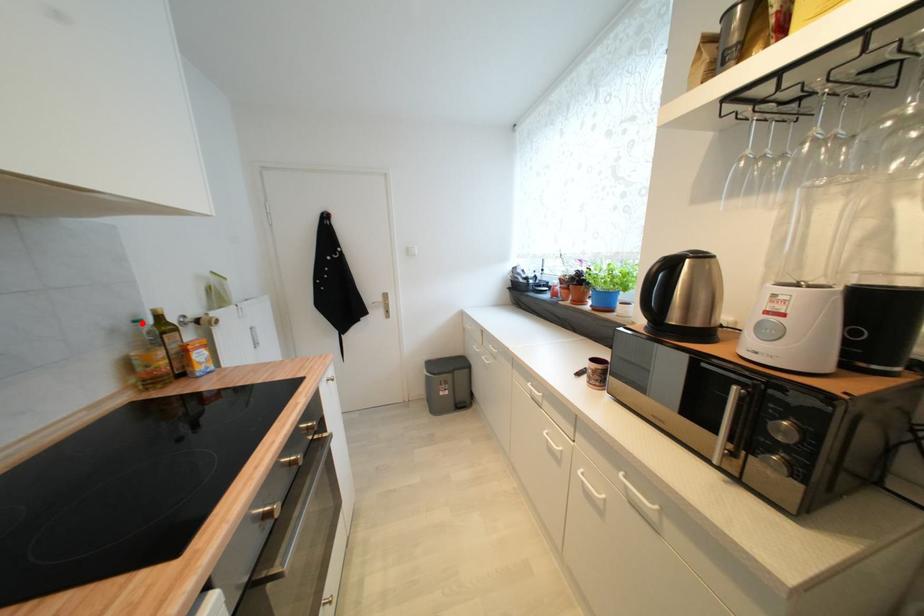
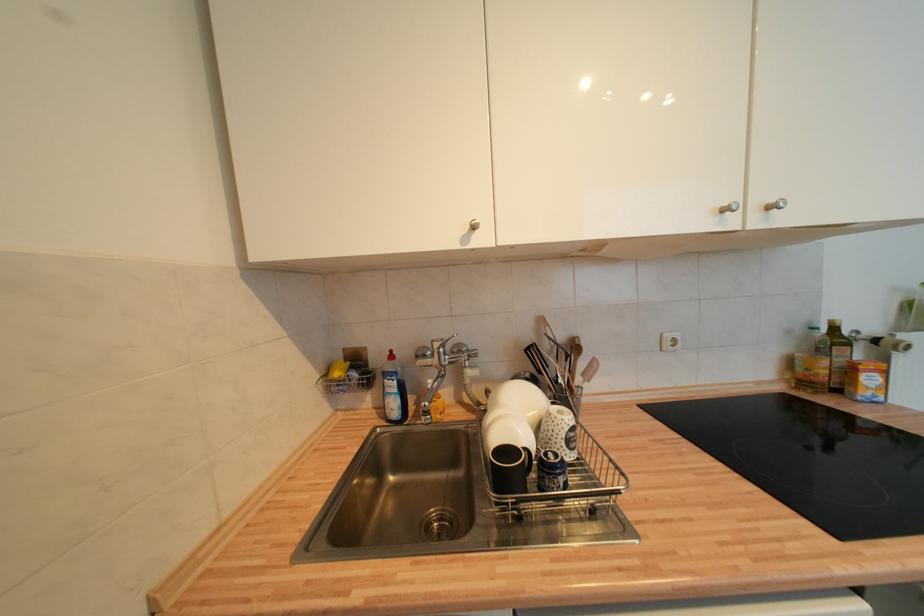
Locate, in the second image, the point that corresponds to the highlighted location in the first image.

(819, 331)